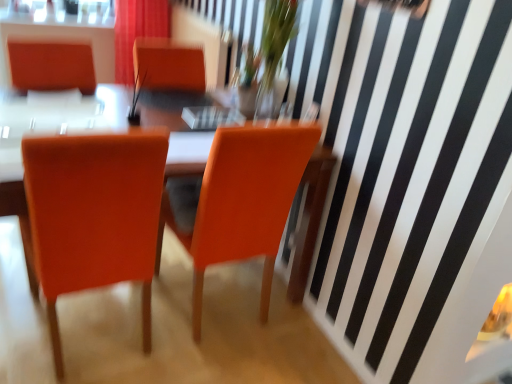
Question: From a real-world perspective, is matte red curtain at upper center above or below matte orange chair at center, the second chair positioned from the right?

Choices:
 (A) below
 (B) above

Answer: (B)

Question: From the image's perspective, is matte red curtain at upper center located above or below matte orange chair at center, the second chair positioned from the right?

Choices:
 (A) above
 (B) below

Answer: (A)

Question: Considering the real-world distances, which object is farthest from the translucent glass vase at upper center?

Choices:
 (A) matte orange table at center
 (B) matte red curtain at upper center
 (C) orange leather chair at center, marked as the 1th chair in a right-to-left arrangement
 (D) matte orange chair at center, placed as the first chair when sorted from left to right
 (E) clear glass vase at upper center

Answer: (B)

Question: Which object is the closest to the orange leather chair at center, marked as the 1th chair in a right-to-left arrangement?

Choices:
 (A) matte red curtain at upper center
 (B) matte orange table at center
 (C) clear glass vase at upper center
 (D) matte orange chair at center, placed as the first chair when sorted from left to right
 (E) translucent glass vase at upper center

Answer: (D)